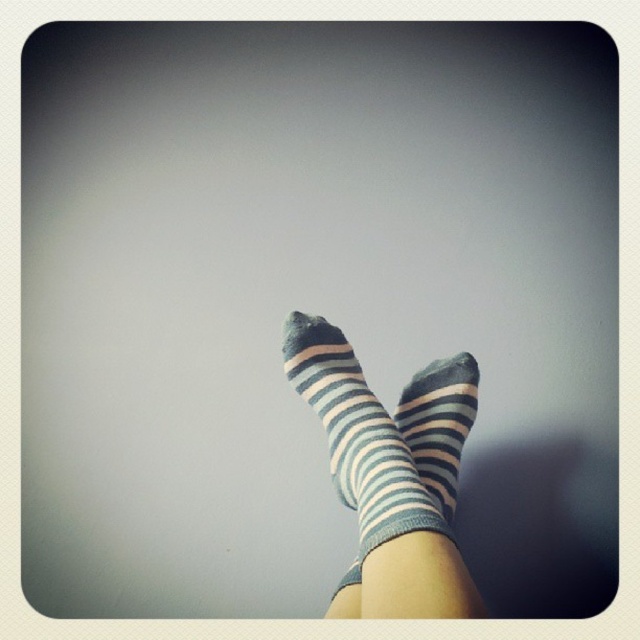
You are trying to choose a pair of socks to wear. You have two options in front of you, the blue striped socks at center and the striped cotton socks at center. Based on their height, which pair would reach higher up your leg?

The blue striped socks at center is much taller as striped cotton socks at center, so the blue striped socks at center would reach higher up your leg.

You are a photographer setting up a shoot with two pairs of socks displayed on a plain gray background. You notice the blue striped socks at center and the striped cotton socks at center. Which pair of socks appears nearer to you?

The blue striped socks at center appears nearer to the viewer because it is closer than the striped cotton socks at center.